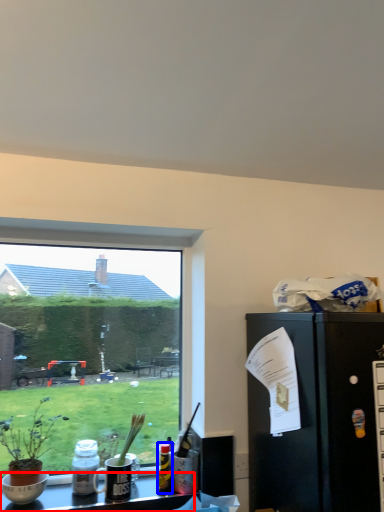
Question: Among these objects, which one is nearest to the camera, desk (highlighted by a red box) or bottle (highlighted by a blue box)?

Choices:
 (A) desk
 (B) bottle

Answer: (A)